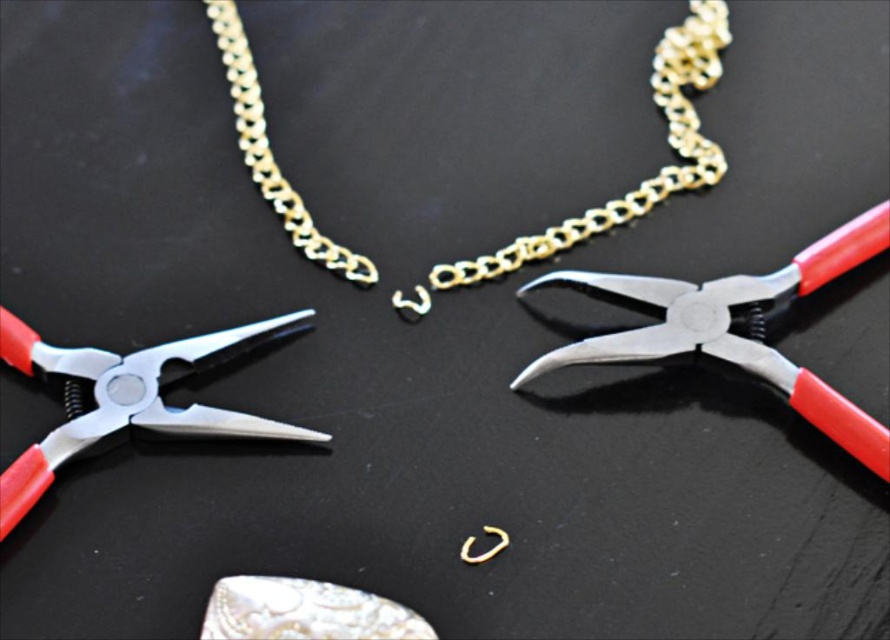
You are a jeweler trying to locate two points in the workspace. The first point is at coordinate point (x=445, y=273) and the second is at point (x=159, y=422). Which point is closer to you?

Point (x=445, y=273) is closer to you than point (x=159, y=422) because it is further to the viewer.

You are a jeweler who needs to reach the metallic silver pliers at center to fix a broken chain. If you are currently standing 3.5 feet away from the pliers, can you comfortably reach them without moving your position?

The metallic silver pliers at center and viewer are 4.03 feet apart from each other. Since you are 3.5 feet away, you are closer than the 4.03 feet distance, so you can comfortably reach them without moving.